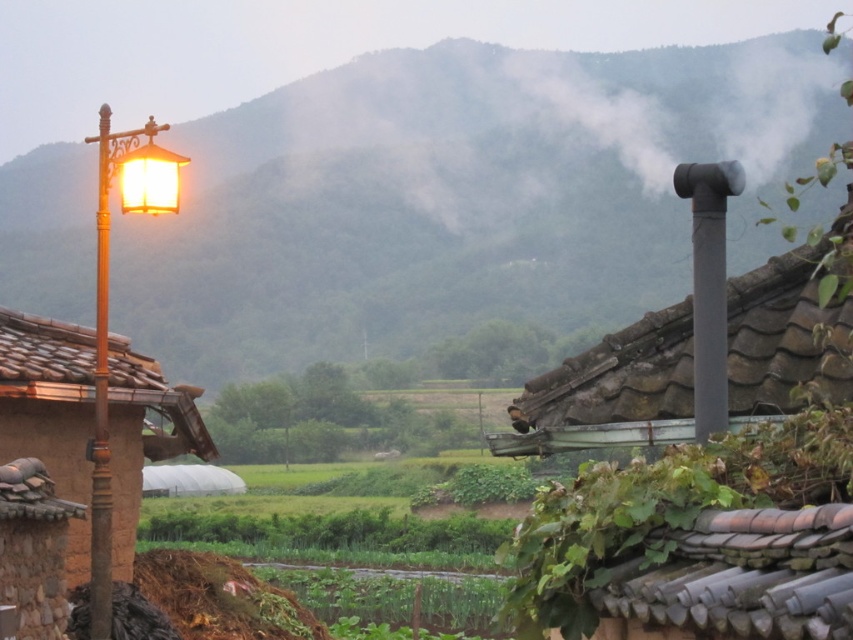
Question: Does gray stone chimney at upper right have a larger size compared to matte brown post at left?

Choices:
 (A) no
 (B) yes

Answer: (B)

Question: Is gray stone chimney at upper right to the right of matte brown post at left from the viewer's perspective?

Choices:
 (A) no
 (B) yes

Answer: (B)

Question: Which of these objects is positioned farthest from the matte brown post at left?

Choices:
 (A) wooden lamp post at left
 (B) green leafy hillside at upper center
 (C) gray stone chimney at upper right

Answer: (B)

Question: Among these objects, which one is nearest to the camera?

Choices:
 (A) gray stone chimney at upper right
 (B) wooden lamp post at left

Answer: (A)

Question: Does green leafy hillside at upper center have a larger size compared to wooden lamp post at left?

Choices:
 (A) yes
 (B) no

Answer: (A)

Question: Which point is farther to the camera?

Choices:
 (A) (196, 147)
 (B) (99, 387)
 (C) (624, 400)
 (D) (51, 369)

Answer: (A)